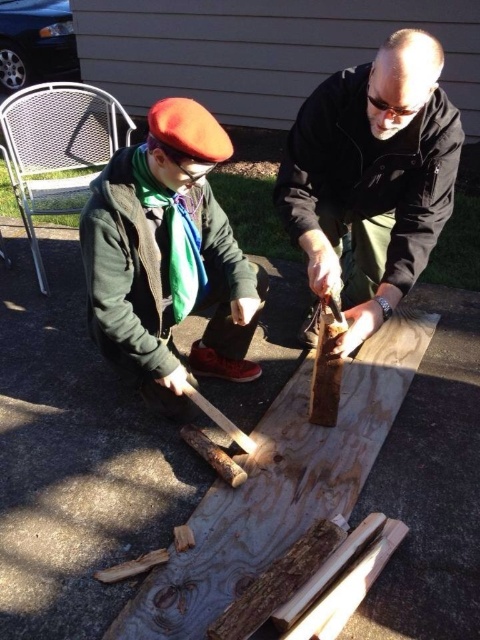
Can you confirm if matte green jacket at center is positioned above wooden plank at center?

Indeed, matte green jacket at center is positioned over wooden plank at center.

I want to click on matte green jacket at center, so click(x=168, y=256).

Does matte black shirt at center appear on the right side of wooden plank at center?

Correct, you'll find matte black shirt at center to the right of wooden plank at center.

Consider the image. Does matte black shirt at center have a lesser height compared to wooden plank at center?

No, matte black shirt at center is not shorter than wooden plank at center.

I want to click on matte black shirt at center, so click(372, 176).

Does matte black shirt at center have a lesser height compared to matte green jacket at center?

In fact, matte black shirt at center may be taller than matte green jacket at center.

Is matte black shirt at center positioned in front of matte green jacket at center?

No.

Is point (358, 84) positioned after point (194, 131)?

Yes.

Locate an element on the screen. matte black shirt at center is located at coordinates (372, 176).